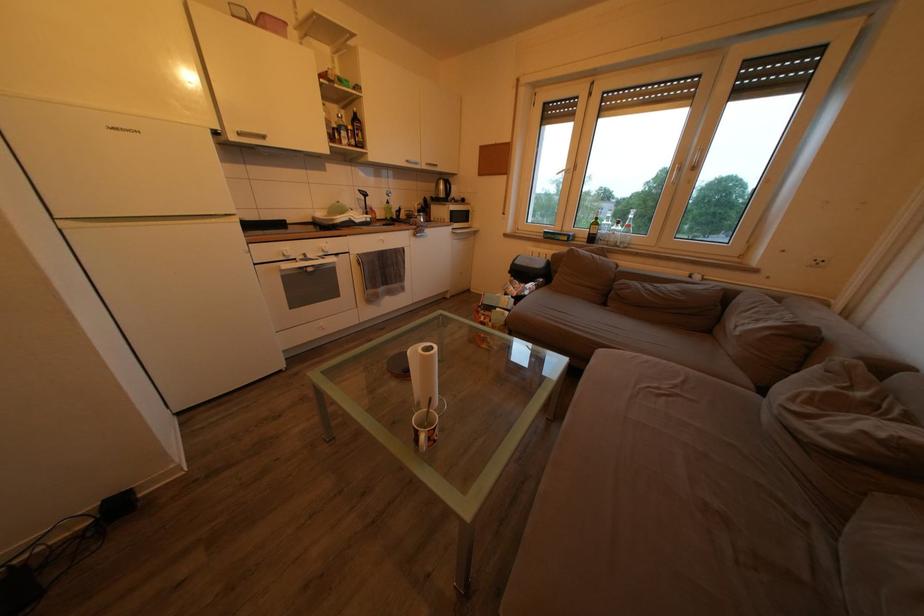
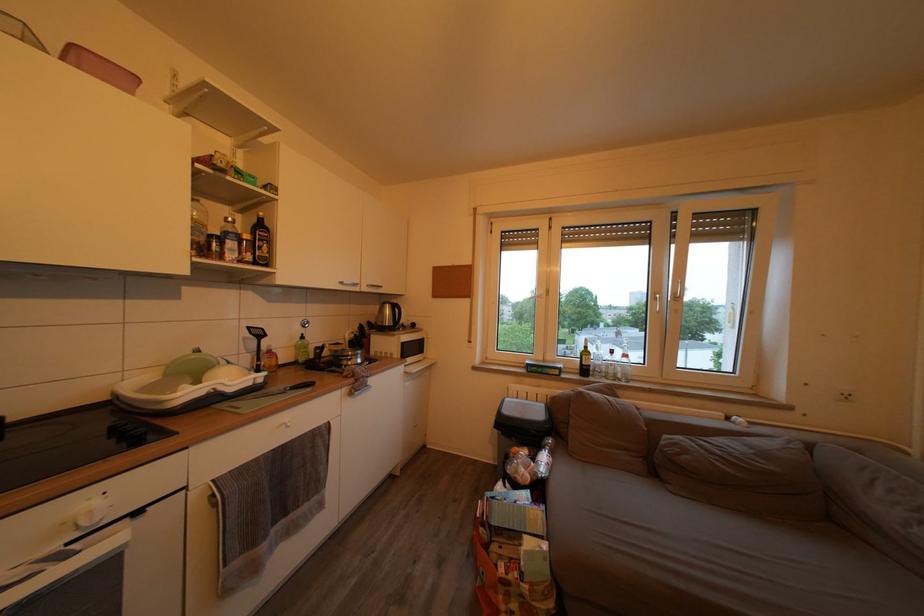
In the second image, find the point that corresponds to [402,217] in the first image.

(320, 353)